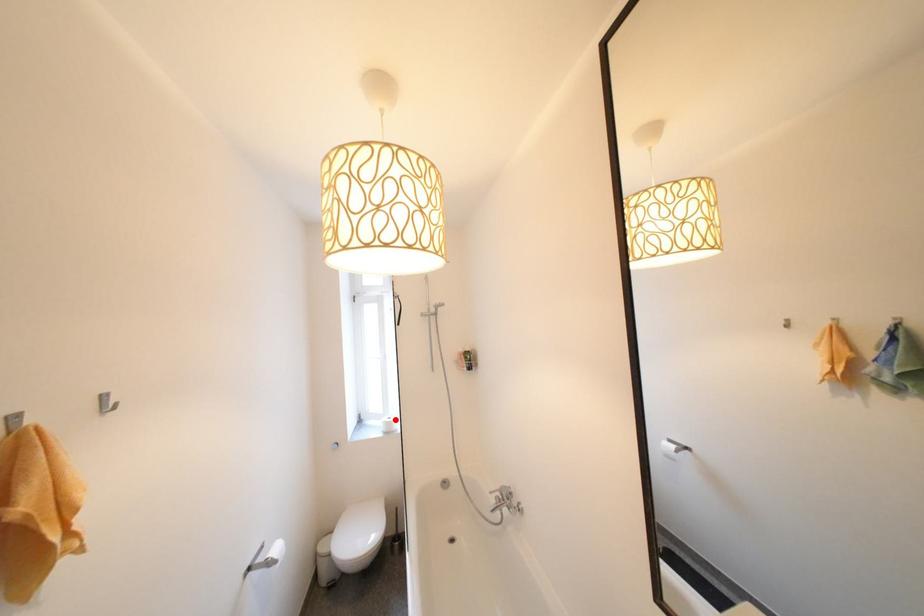
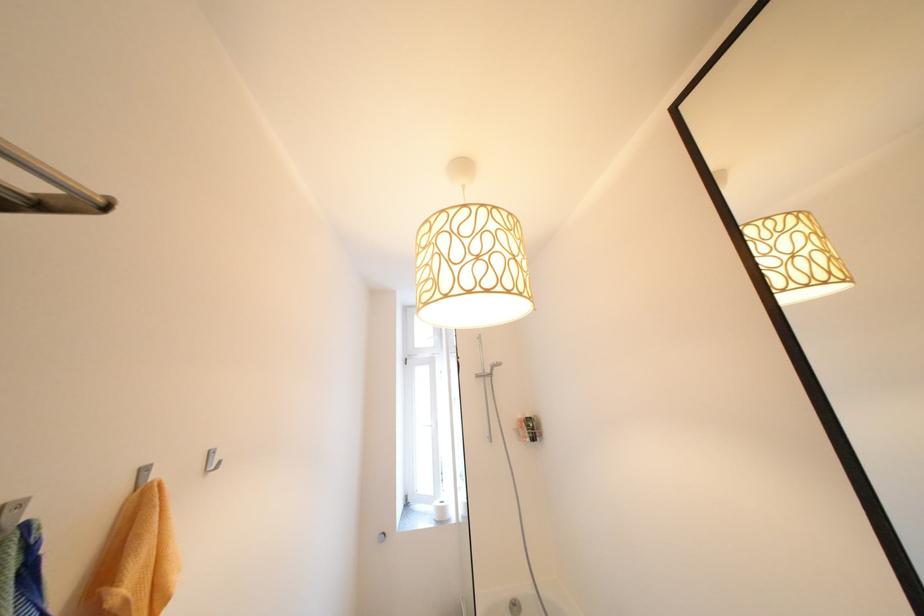
Where in the second image is the point corresponding to the highlighted location from the first image?

(447, 504)